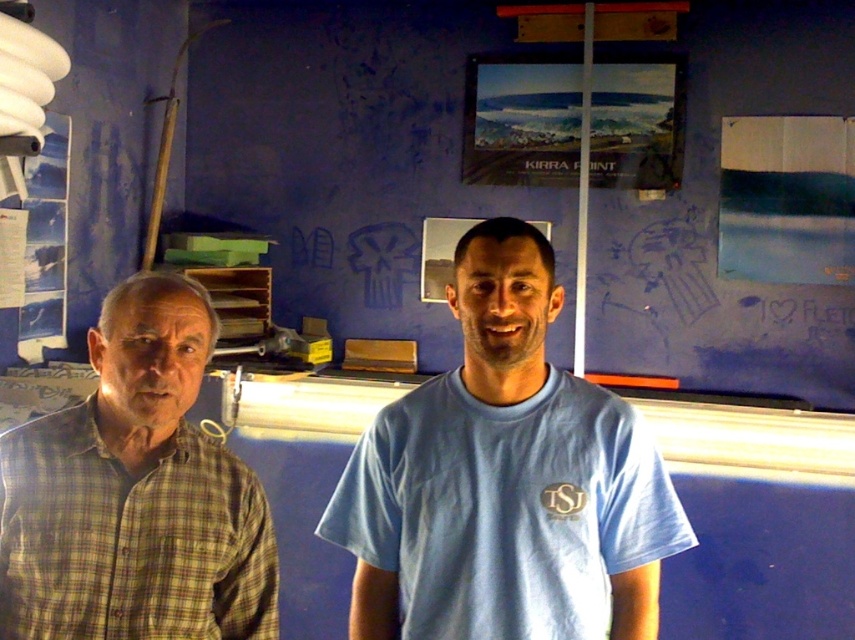
Can you confirm if blue matte bulletin board at upper center is positioned above light blue t-shirt at center?

Yes.

Does blue matte bulletin board at upper center lie behind light blue t-shirt at center?

Yes, blue matte bulletin board at upper center is behind light blue t-shirt at center.

Between point (453, 148) and point (594, 611), which one is positioned in front?

Point (594, 611)

Where is `blue matte bulletin board at upper center`? blue matte bulletin board at upper center is located at coordinates (352, 154).

Who is positioned more to the left, light blue t-shirt at center or yellow-green plaid shirt at left?

Positioned to the left is yellow-green plaid shirt at left.

Is light blue t-shirt at center further to camera compared to yellow-green plaid shirt at left?

Yes, light blue t-shirt at center is further from the viewer.

Is point (608, 458) positioned in front of point (193, 532)?

No, (608, 458) is behind (193, 532).

The height and width of the screenshot is (640, 855). What are the coordinates of `light blue t-shirt at center` in the screenshot? It's located at (505, 481).

Consider the image. Does blue matte bulletin board at upper center appear on the left side of yellow-green plaid shirt at left?

No, blue matte bulletin board at upper center is not to the left of yellow-green plaid shirt at left.

Does blue matte bulletin board at upper center appear under yellow-green plaid shirt at left?

Actually, blue matte bulletin board at upper center is above yellow-green plaid shirt at left.

Between point (488, 48) and point (81, 632), which one is positioned behind?

The point (488, 48) is more distant.

The image size is (855, 640). What are the coordinates of `blue matte bulletin board at upper center` in the screenshot? It's located at (352, 154).